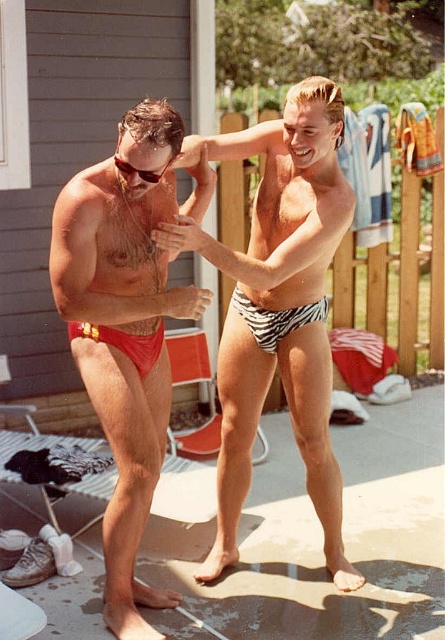
You are organizing a pool party and need to ensure that all swimwear items are appropriately sized. Given that the matte red swim trunks at left and the matte red bikini bottom at lower left are both red, which one would you recommend for someone who prefers a larger size?

The matte red swim trunks at left are bigger than the matte red bikini bottom at lower left, so I would recommend the matte red swim trunks at left for someone who prefers a larger size.

You are a lifeguard who needs to retrieve an object from the water. You see the matte red bikini bottom at lower left and the matte black sunglasses at upper center. Which object is closer to you?

The matte red bikini bottom at lower left is closer to you since it is only 28.02 inches away from the matte black sunglasses at upper center, which is the closest distance mentioned.